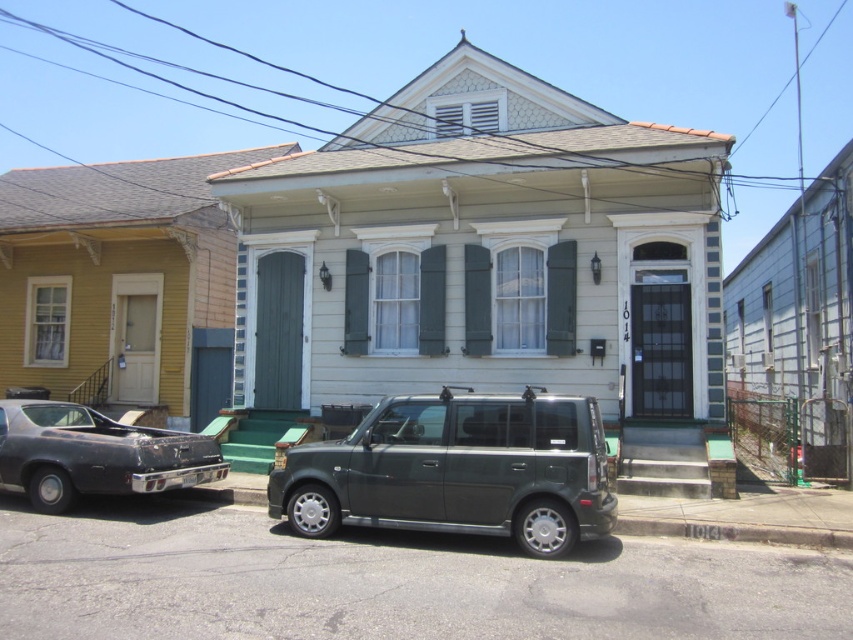
You are a delivery person trying to park your van in the residential street scene. You see the metallic gray suv at center and the rusty metal car at lower left. Which vehicle should you move to access the parking spot behind them?

You should move the metallic gray suv at center because it is in front of the rusty metal car at lower left, so moving it will allow access to the parking spot behind.